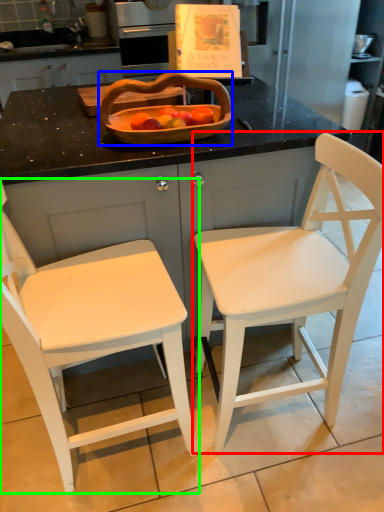
Question: Considering the real-world distances, which object is closest to chair (highlighted by a red box)? basket (highlighted by a blue box) or chair (highlighted by a green box).

Choices:
 (A) basket
 (B) chair

Answer: (B)